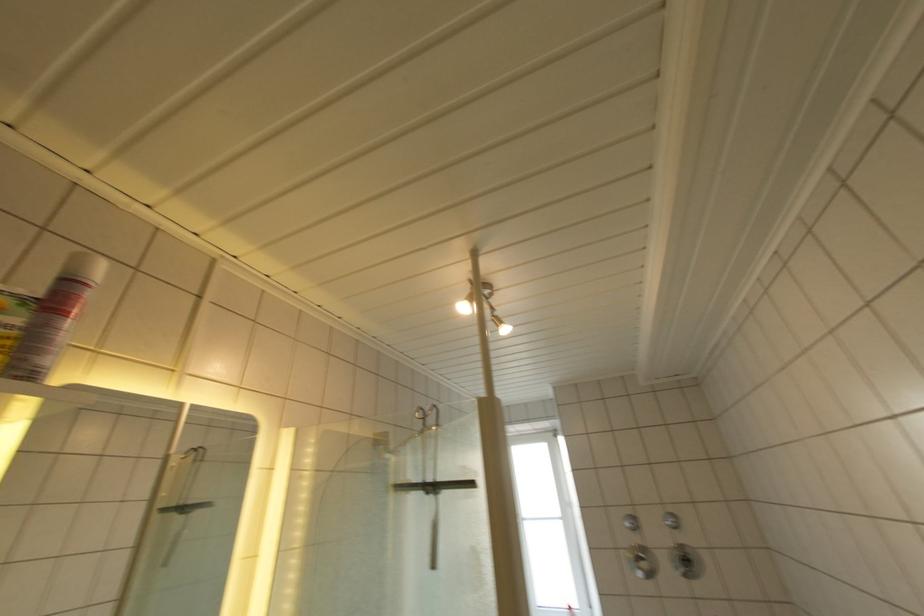
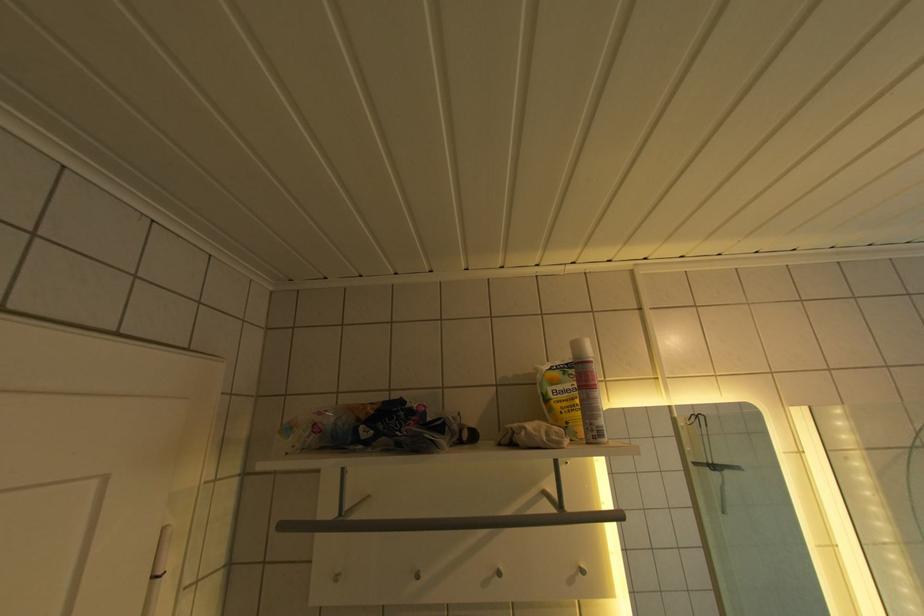
Question: How did the camera likely rotate?

Choices:
 (A) Left
 (B) Right
 (C) Up
 (D) Down

Answer: (A)